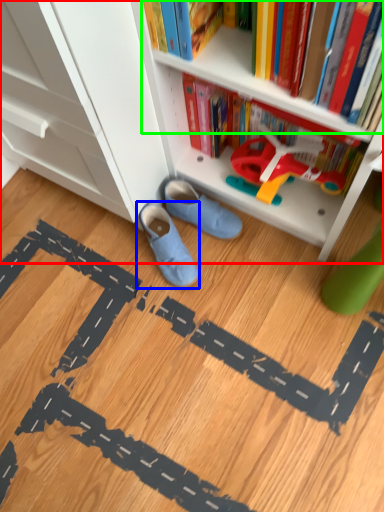
Question: Based on their relative distances, which object is nearer to bookcase (highlighted by a red box)? Choose from footwear (highlighted by a blue box) and book (highlighted by a green box).

Choices:
 (A) footwear
 (B) book

Answer: (B)